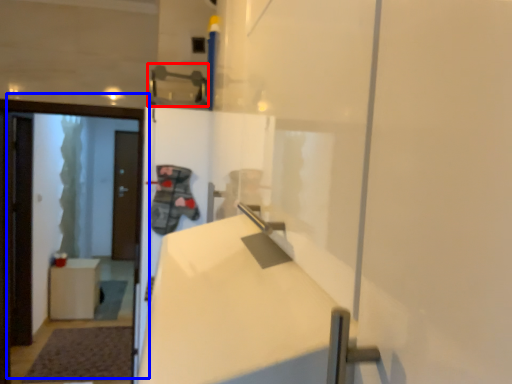
Question: Which object appears closest to the camera in this image, door handle (highlighted by a red box) or door (highlighted by a blue box)?

Choices:
 (A) door handle
 (B) door

Answer: (A)